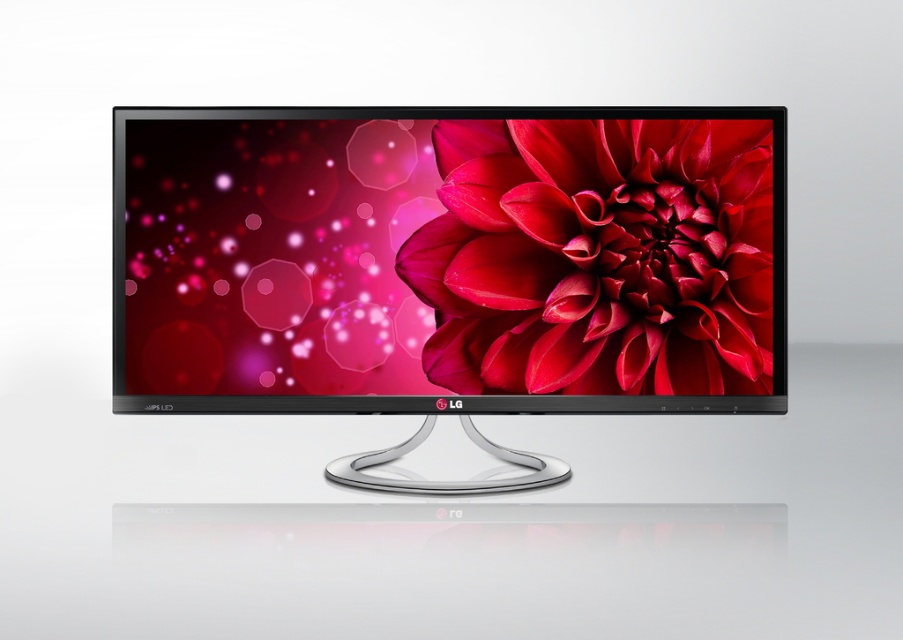
Question: Which point appears closest to the camera in this image?

Choices:
 (A) (592, 378)
 (B) (684, 285)

Answer: (B)

Question: Does satin black monitor at center have a lesser width compared to matte red flower at center?

Choices:
 (A) yes
 (B) no

Answer: (B)

Question: Can you confirm if satin black monitor at center is positioned to the left of matte red flower at center?

Choices:
 (A) no
 (B) yes

Answer: (B)

Question: Is satin black monitor at center to the right of matte red flower at center from the viewer's perspective?

Choices:
 (A) yes
 (B) no

Answer: (B)

Question: Which point is closer to the camera?

Choices:
 (A) (528, 243)
 (B) (268, 212)

Answer: (B)